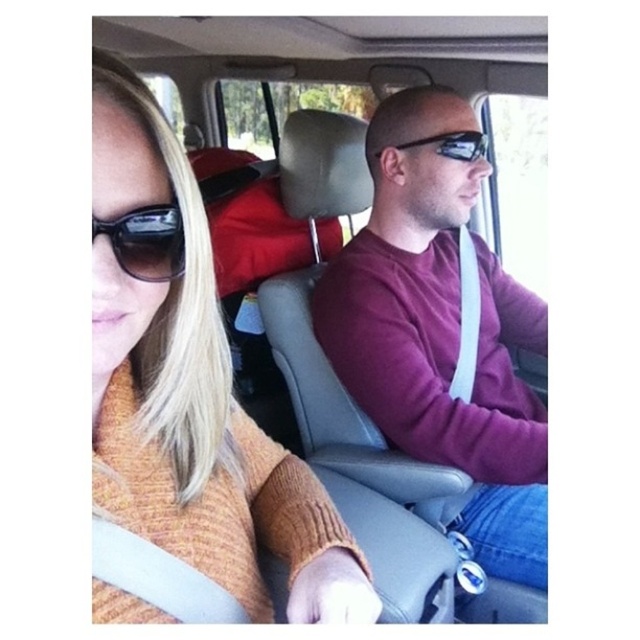
Can you confirm if maroon sweater at center is positioned below matte black sunglasses at upper left?

Yes, maroon sweater at center is below matte black sunglasses at upper left.

Between point (508, 476) and point (116, 218), which one is positioned in front?

Point (116, 218)

What are the coordinates of `maroon sweater at center` in the screenshot? It's located at (440, 333).

Is matte black sunglasses at upper left shorter than shiny black sunglasses at center?

Correct, matte black sunglasses at upper left is not as tall as shiny black sunglasses at center.

The width and height of the screenshot is (640, 640). I want to click on matte black sunglasses at upper left, so click(147, 241).

Who is higher up, red fabric seat at center or shiny black sunglasses at center?

Positioned higher is red fabric seat at center.

Is red fabric seat at center wider than shiny black sunglasses at center?

Yes, red fabric seat at center is wider than shiny black sunglasses at center.

Does point (328, 248) lie in front of point (465, 141)?

No.

This screenshot has height=640, width=640. In order to click on red fabric seat at center in this screenshot , I will do `click(253, 237)`.